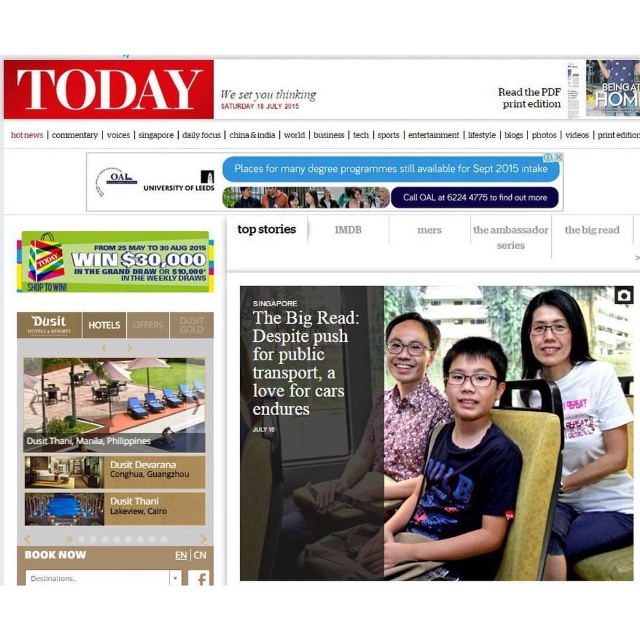
Question: Which of the following is the farthest from the observer?

Choices:
 (A) white cotton t-shirt at upper right
 (B) dark blue cotton t-shirt at center

Answer: (A)

Question: Does white cotton t-shirt at upper right appear on the right side of matte black glasses at upper center?

Choices:
 (A) yes
 (B) no

Answer: (A)

Question: Which object is the closest to the white cotton t-shirt at upper right?

Choices:
 (A) dark blue cotton t-shirt at center
 (B) matte brown shirt at center

Answer: (A)

Question: Does dark blue cotton t-shirt at center have a smaller size compared to matte black glasses at upper center?

Choices:
 (A) yes
 (B) no

Answer: (B)

Question: Can you confirm if dark blue cotton t-shirt at center is positioned below matte brown shirt at center?

Choices:
 (A) yes
 (B) no

Answer: (A)

Question: Which point appears closest to the camera in this image?

Choices:
 (A) (577, 323)
 (B) (461, 486)
 (C) (241, 198)
 (D) (308, 532)

Answer: (B)